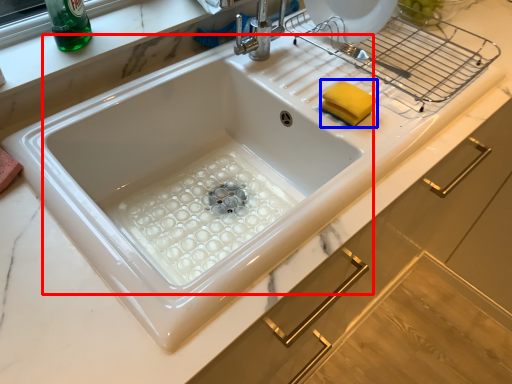
Question: Which object is further to the camera taking this photo, sink (highlighted by a red box) or food (highlighted by a blue box)?

Choices:
 (A) sink
 (B) food

Answer: (B)